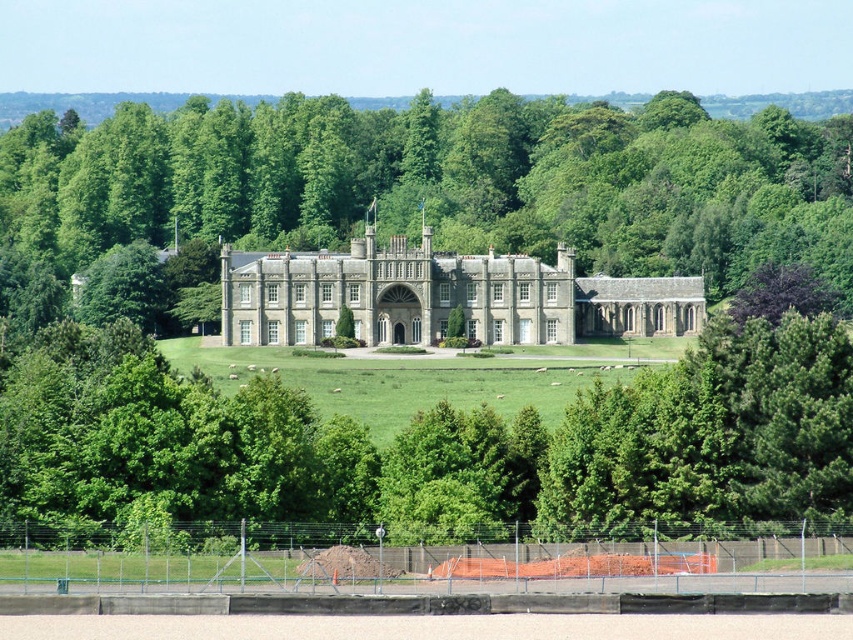
You are standing at the entrance of the grand historic building and want to find the green leafy tree at center. According to the coordinates given, where should you look relative to the building?

The green leafy tree at center is located at coordinates point (444,180), which means it is positioned to the left and slightly forward from the center of the building.

In the scene shown: You are standing at the point marked as point (444, 180) in the image. What do you see directly in front of you?

You see a green leafy tree at center directly in front of you at point (444, 180).